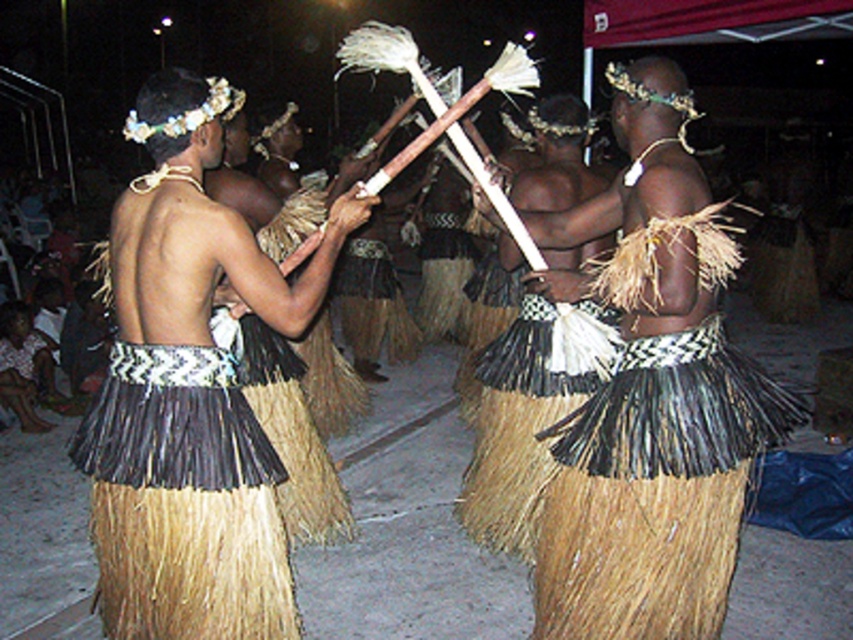
You are a photographer capturing the dancers in the scene. You notice two skirts at the center of the image. Which skirt is taller between the natural straw skirt at center and the black woven grass skirt at center?

The natural straw skirt at center is taller than the black woven grass skirt at center according to the description.

You are a photographer standing at the front row. You want to take a photo focusing on the natural straw skirt at center and the black woven grass skirt at center. Which skirt will appear larger in your photo?

The natural straw skirt at center will appear larger in the photo because it is closer to the viewer than the black woven grass skirt at center.